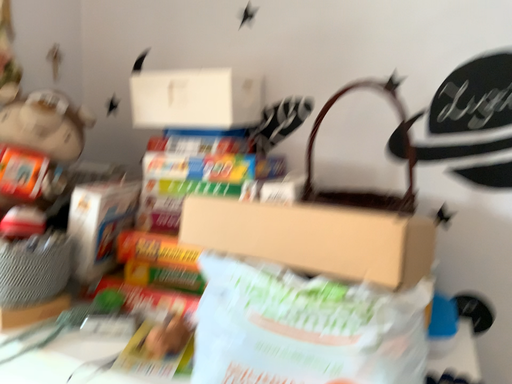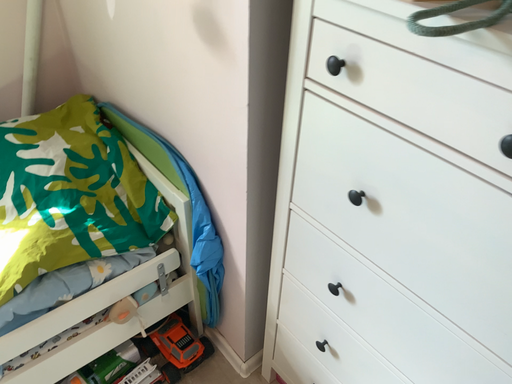
Question: Which way did the camera rotate in the video?

Choices:
 (A) rotated downward
 (B) rotated upward

Answer: (A)